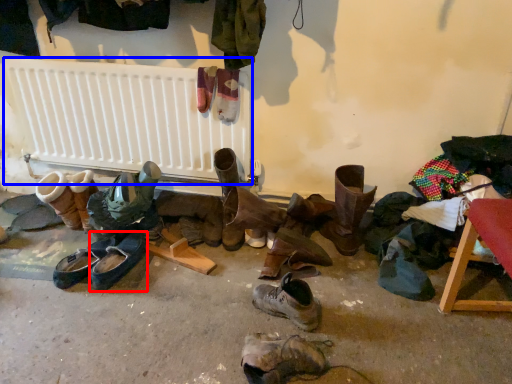
Question: Which point is closer to the camera, footwear (highlighted by a red box) or radiator (highlighted by a blue box)?

Choices:
 (A) footwear
 (B) radiator

Answer: (A)